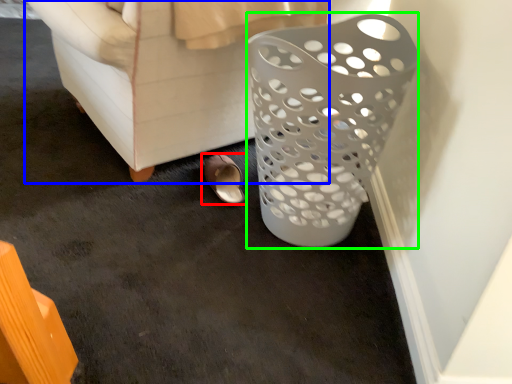
Question: Estimate the real-world distances between objects in this image. Which object is closer to footwear (highlighted by a red box), furniture (highlighted by a blue box) or basket (highlighted by a green box)?

Choices:
 (A) furniture
 (B) basket

Answer: (A)